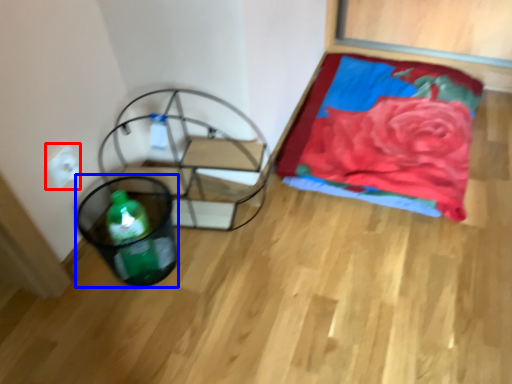
Question: Which point is further to the camera, electric outlet (highlighted by a red box) or basket (highlighted by a blue box)?

Choices:
 (A) electric outlet
 (B) basket

Answer: (A)